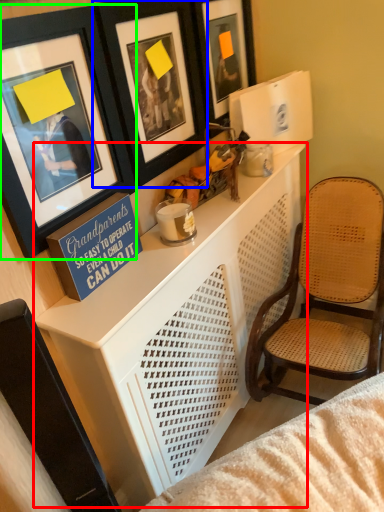
Question: Which object is the farthest from table (highlighted by a red box)? Choose among these: picture frame (highlighted by a blue box) or picture frame (highlighted by a green box).

Choices:
 (A) picture frame
 (B) picture frame

Answer: (A)